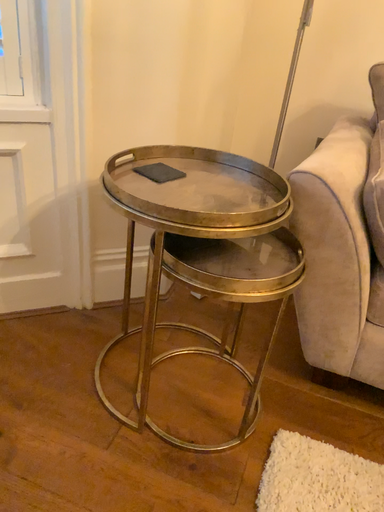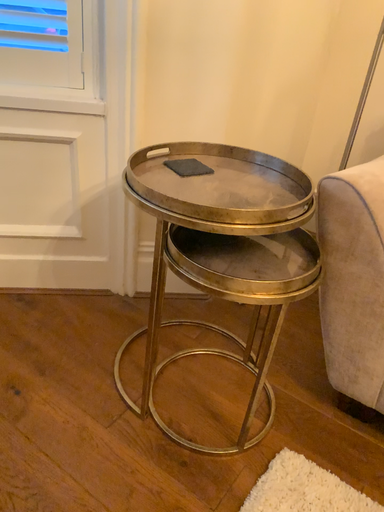
Question: How did the camera likely rotate when shooting the video?

Choices:
 (A) rotated right
 (B) rotated left

Answer: (B)